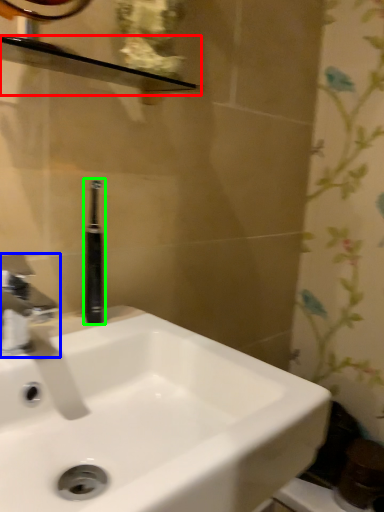
Question: Which object is positioned farthest from balustrade (highlighted by a red box)? Select from tap (highlighted by a blue box) and toiletry (highlighted by a green box).

Choices:
 (A) tap
 (B) toiletry

Answer: (A)